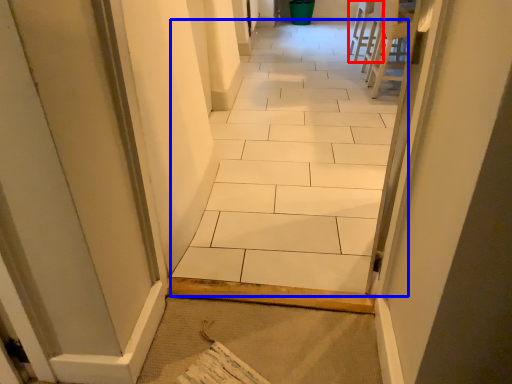
Question: Which point is further to the camera, chair (highlighted by a red box) or ceramic tile (highlighted by a blue box)?

Choices:
 (A) chair
 (B) ceramic tile

Answer: (A)